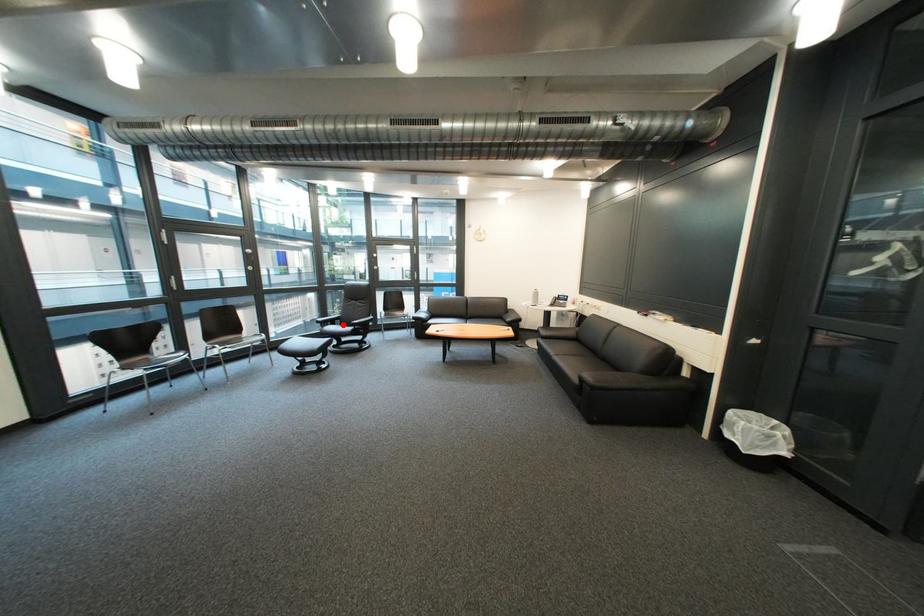
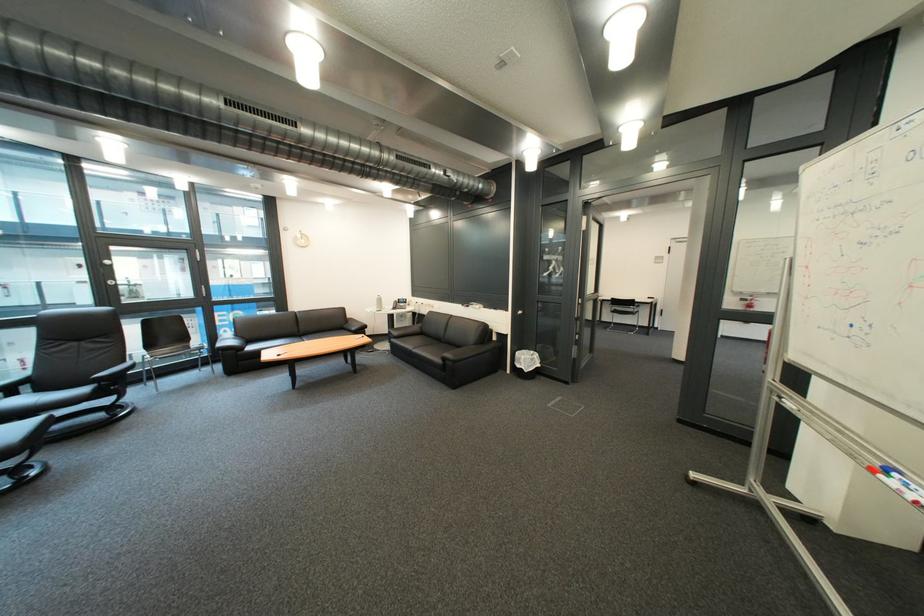
Locate, in the second image, the point that corresponds to the highlighted location in the first image.

(16, 395)